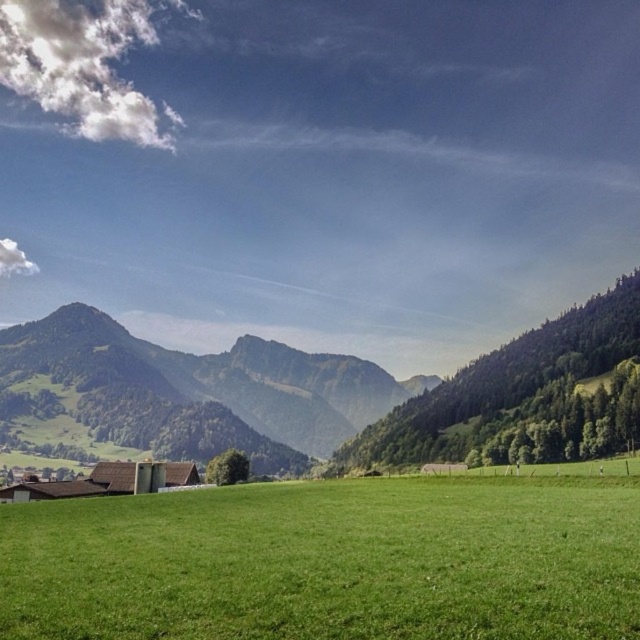
Which is behind, point (458, 548) or point (307, 362)?

The point (307, 362) is more distant.

Which is behind, point (115, 502) or point (244, 406)?

Positioned behind is point (244, 406).

Locate an element on the screen. green grass pasture at center is located at coordinates (330, 561).

Can you confirm if green grass pasture at center is positioned to the right of green grassy field at lower left?

Indeed, green grass pasture at center is positioned on the right side of green grassy field at lower left.

Who is more distant from viewer, (205, 550) or (451, 424)?

Positioned behind is point (451, 424).

Identify the location of green grass pasture at center. This screenshot has height=640, width=640. (330, 561).

Identify the location of green grass pasture at center. (330, 561).

Looking at this image, does green grassy field at lower left have a greater width compared to green grassy mountain at left?

Indeed, green grassy field at lower left has a greater width compared to green grassy mountain at left.

Who is positioned more to the right, green grassy field at lower left or green grassy mountain at left?

Positioned to the right is green grassy field at lower left.

Does point (291, 400) come farther from viewer compared to point (72, 392)?

Yes, it is.

Where is `green grassy field at lower left`? The image size is (640, 640). green grassy field at lower left is located at coordinates (324, 396).